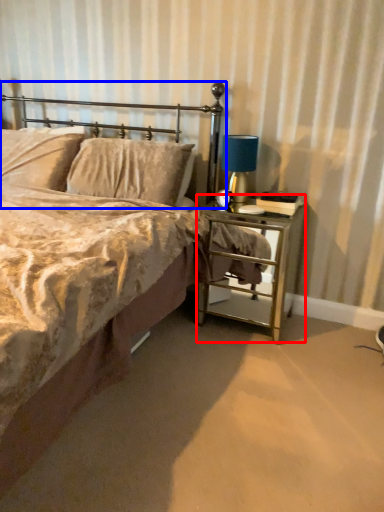
Question: Among these objects, which one is farthest to the camera, nightstand (highlighted by a red box) or headboard (highlighted by a blue box)?

Choices:
 (A) nightstand
 (B) headboard

Answer: (B)